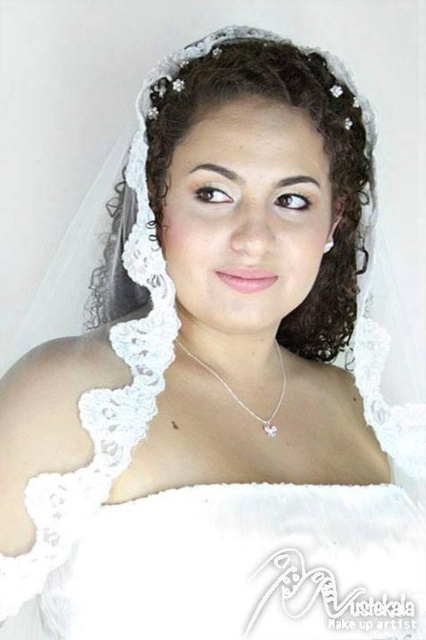
Consider the image. You are a photographer setting up for a wedding photo shoot. You need to position a spotlight to highlight the curly white veil at center. Where should you place the spotlight to best illuminate it?

The curly white veil at center is located at point (325, 152), so you should place the spotlight at that coordinate to best illuminate it.